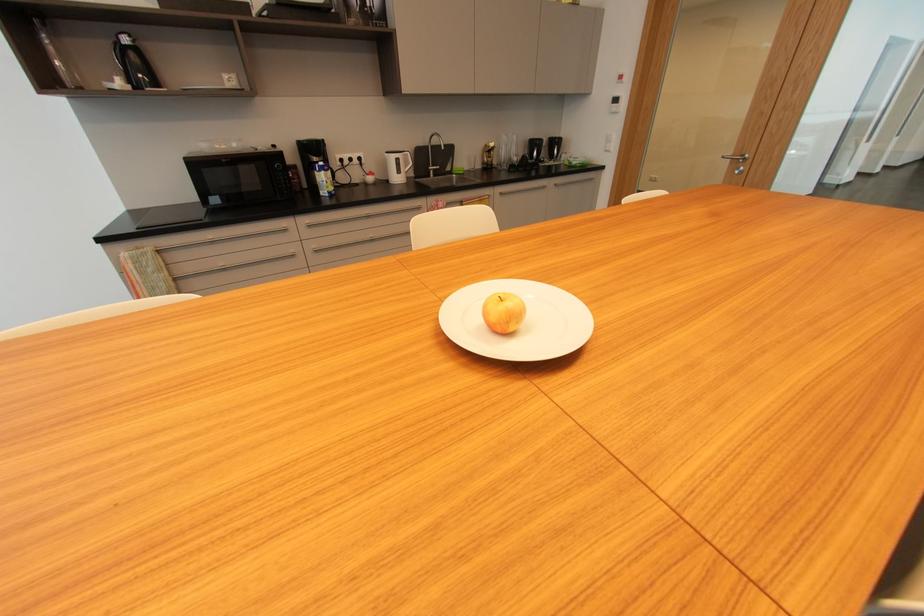
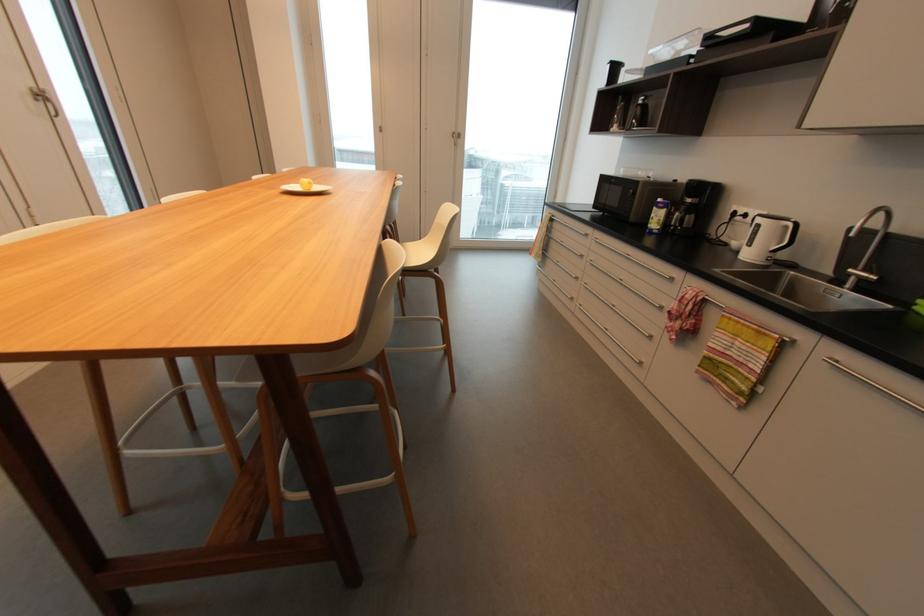
In the second image, find the point that corresponds to pixel 433 168 in the first image.

(854, 270)